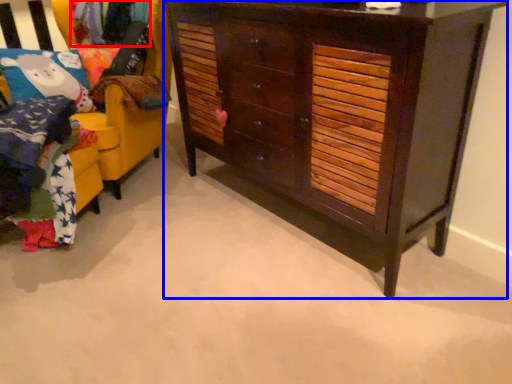
Question: Which object appears farthest to the camera in this image, clothing (highlighted by a red box) or chest of drawers (highlighted by a blue box)?

Choices:
 (A) clothing
 (B) chest of drawers

Answer: (A)